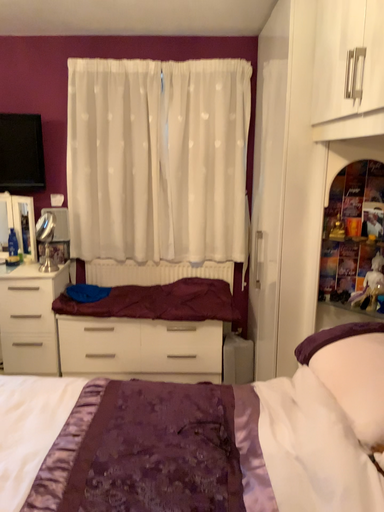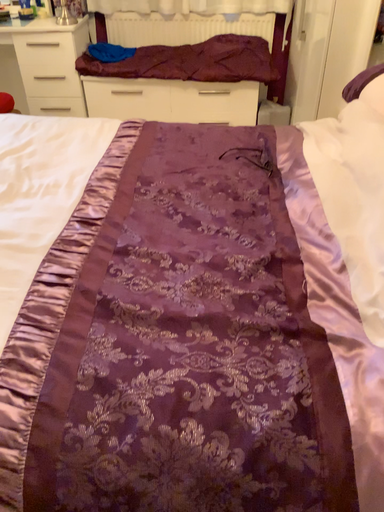
Question: How did the camera likely rotate when shooting the video?

Choices:
 (A) rotated downward
 (B) rotated upward

Answer: (A)